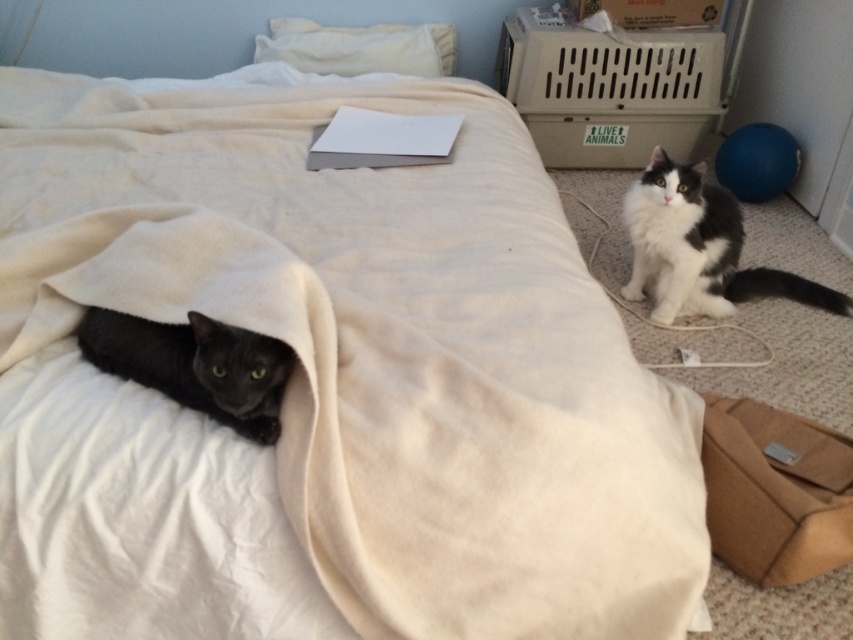
Question: Which of the following is the farthest from the observer?

Choices:
 (A) (207, 330)
 (B) (776, 536)

Answer: (B)

Question: Which object is positioned closest to the white fluffy cat at right?

Choices:
 (A) white soft pillow at upper center
 (B) brown fabric bag at lower right

Answer: (B)

Question: Is white fluffy cat at right thinner than shiny black cat at lower left?

Choices:
 (A) no
 (B) yes

Answer: (A)

Question: In this image, where is brown fabric bag at lower right located relative to shiny black cat at lower left?

Choices:
 (A) right
 (B) left

Answer: (A)

Question: Is brown fabric bag at lower right smaller than white fluffy cat at right?

Choices:
 (A) yes
 (B) no

Answer: (A)

Question: Which is nearer to the white soft pillow at upper center?

Choices:
 (A) brown fabric bag at lower right
 (B) white fluffy cat at right
 (C) shiny black cat at lower left

Answer: (B)